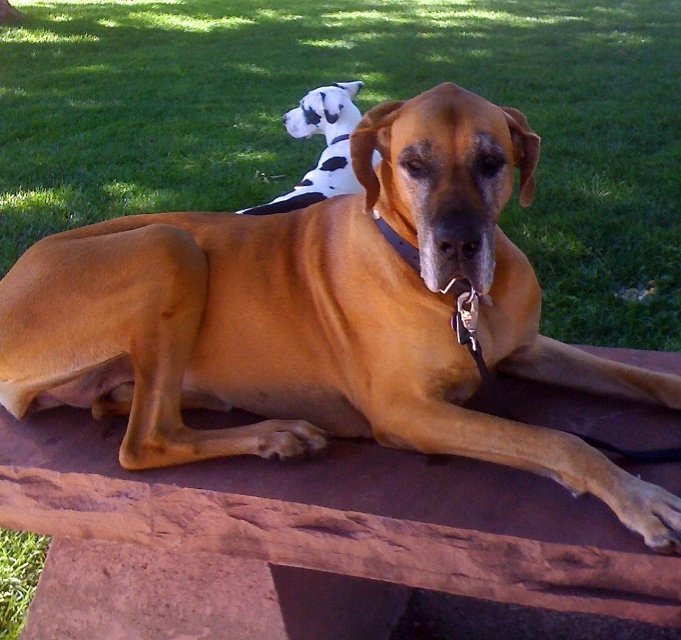
Question: Can you confirm if brown smooth dog at center is positioned below green grass at upper center?

Choices:
 (A) no
 (B) yes

Answer: (B)

Question: Among these points, which one is nearest to the camera?

Choices:
 (A) (584, 180)
 (B) (469, 396)

Answer: (B)

Question: Can you confirm if green grass at upper center is positioned below black and white plush toy at upper center?

Choices:
 (A) no
 (B) yes

Answer: (A)

Question: Where is brown smooth dog at center located in relation to green grass at upper center in the image?

Choices:
 (A) right
 (B) left

Answer: (A)

Question: Which point is farther from the camera taking this photo?

Choices:
 (A) (503, 204)
 (B) (326, 140)

Answer: (B)

Question: Which point is farther to the camera?

Choices:
 (A) [x=136, y=432]
 (B) [x=330, y=160]
 (C) [x=554, y=104]

Answer: (C)